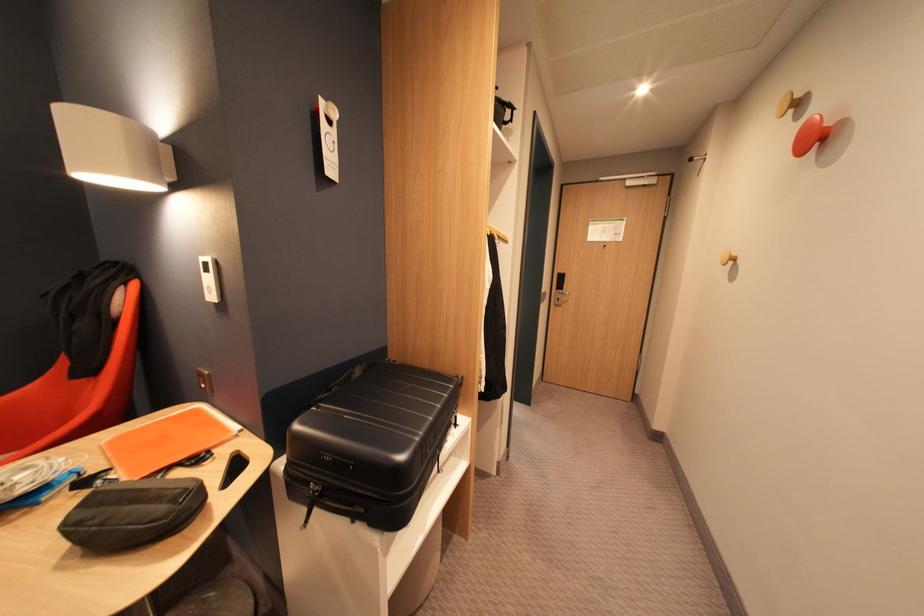
Find where to lift the suitcase top handle. Please return your answer as a coordinate pair (x, y).

(337, 505)